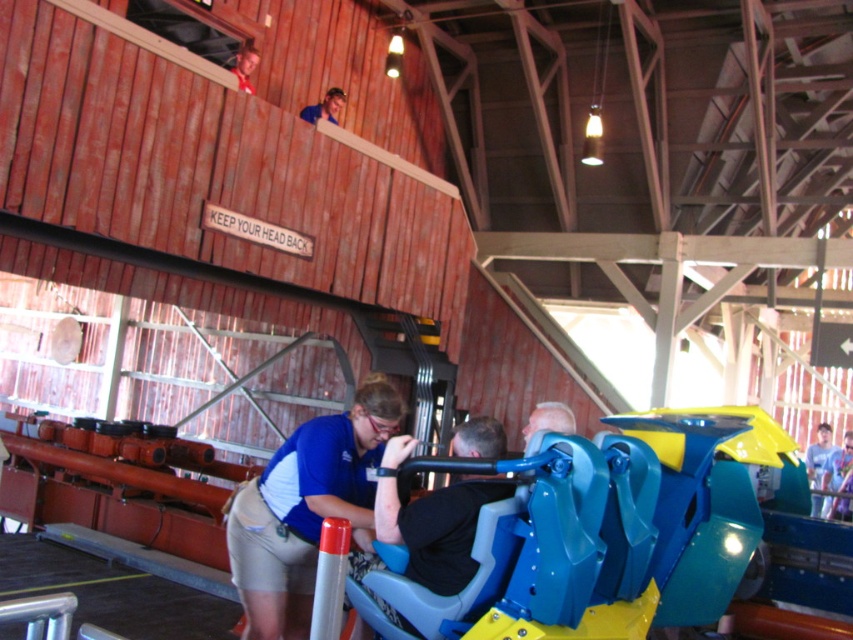
Question: Can you confirm if blue fabric shirt at center is smaller than light blue shirt at center?

Choices:
 (A) no
 (B) yes

Answer: (B)

Question: Which of these objects is positioned farthest from the blue fabric shirt at center?

Choices:
 (A) blue shirt at upper center
 (B) light blue shirt at center

Answer: (B)

Question: Which object appears farthest from the camera in this image?

Choices:
 (A) blue fabric shirt at center
 (B) blue shirt at upper center

Answer: (B)

Question: From the image, what is the correct spatial relationship of blue fabric shirt at center in relation to blue shirt at upper center?

Choices:
 (A) left
 (B) right

Answer: (B)

Question: Is blue fabric shirt at center in front of light blue shirt at center?

Choices:
 (A) no
 (B) yes

Answer: (B)

Question: Which object is positioned farthest from the blue shirt at upper center?

Choices:
 (A) light blue shirt at center
 (B) blue fabric shirt at center

Answer: (A)